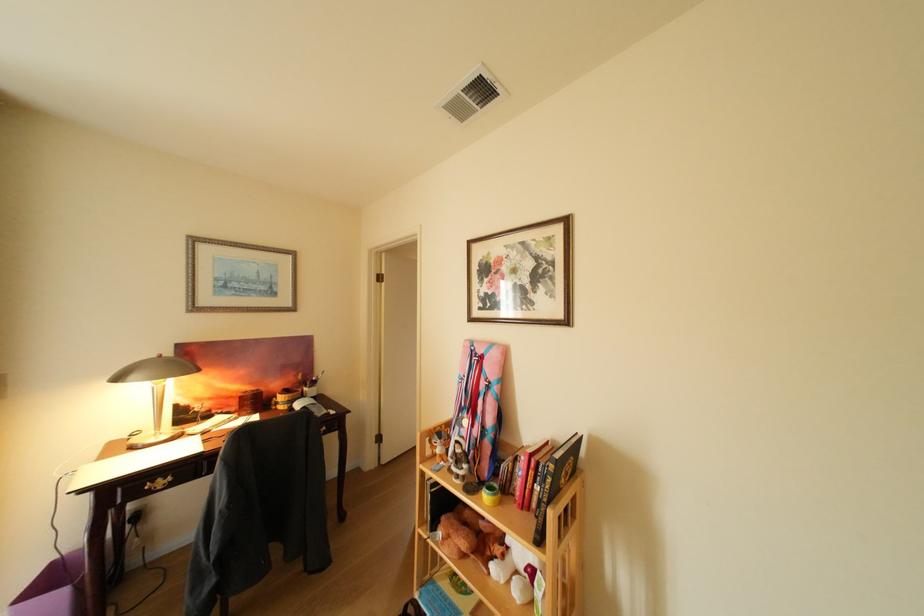
The image size is (924, 616). What do you see at coordinates (157, 483) in the screenshot?
I see `the brass drawer handle` at bounding box center [157, 483].